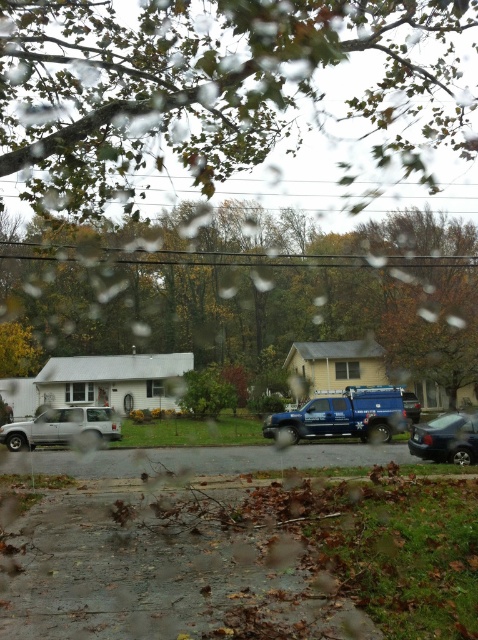
Question: Estimate the real-world distances between objects in this image. Which object is farther from the shiny black sedan at lower right?

Choices:
 (A) green leafy tree at center
 (B) blue metallic truck at center

Answer: (A)

Question: Which of the following is the closest to the observer?

Choices:
 (A) silver metallic suv at left
 (B) green leafy tree at center
 (C) green leafy tree at upper center
 (D) blue metallic truck at center

Answer: (C)

Question: Can you confirm if blue metallic truck at center is bigger than shiny black sedan at lower right?

Choices:
 (A) no
 (B) yes

Answer: (B)

Question: Based on their relative distances, which object is farther from the blue metallic truck at center?

Choices:
 (A) green leafy tree at center
 (B) silver metallic suv at left

Answer: (A)

Question: Is blue metallic truck at center to the right of silver metallic suv at left from the viewer's perspective?

Choices:
 (A) no
 (B) yes

Answer: (B)

Question: Does green leafy tree at upper center come in front of silver metallic suv at left?

Choices:
 (A) yes
 (B) no

Answer: (A)